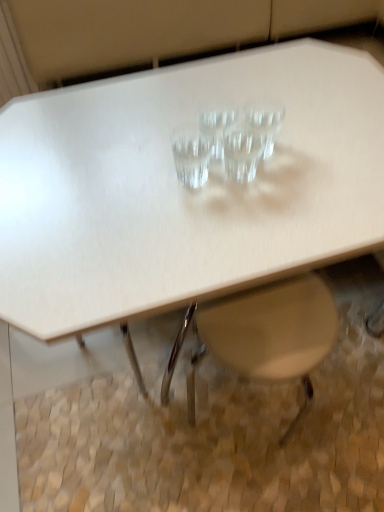
Find the location of `vacant location behind transparent glass martini glass at center, placed as the third martini glass when sorted from right to left`. vacant location behind transparent glass martini glass at center, placed as the third martini glass when sorted from right to left is located at coordinates (209, 102).